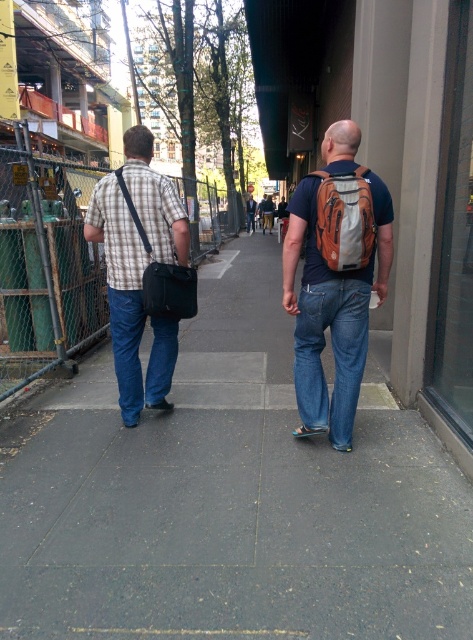
You are a delivery person needing to place both the orange fabric backpack at center and the matte black bag at left into a storage bin that can only hold items narrower than 12 inches. Based on their widths, can both items fit?

The orange fabric backpack at center has a lesser width compared to matte black bag at left. Since the matte black bag at left is wider, it might exceed the 12 inches limit, so only the orange fabric backpack at center can fit into the storage bin.

Looking at this image, you are standing at the camera position observing the scene. There is an orange fabric backpack at center. Where is the orange fabric backpack located in relation to the two people walking away from the camera?

The orange fabric backpack at center is located at point 0.344 along the horizontal axis and 0.729 along the vertical axis relative to the image frame. Since both individuals are walking away from the camera, the backpack is positioned centrally between them, slightly closer to the front person.

You are a photographer standing behind the two people in the image. You want to take a photo that includes both the matte orange backpack at center and the plaid fabric shirt at left in the same frame. Given that your camera has a maximum horizontal field of view of 4 feet, will you be able to capture both objects in one shot?

The matte orange backpack at center and the plaid fabric shirt at left are 3.95 feet apart from each other. Since the distance between them is less than the camera field of view of 4 feet, yes, you can capture both in one shot.